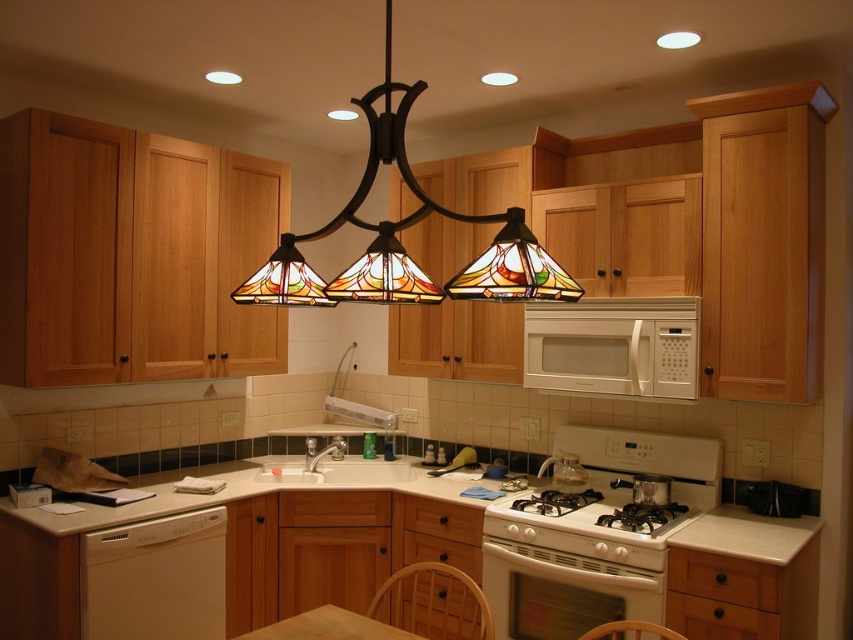
Can you confirm if white glossy oven at lower center is bigger than white glossy gas stove at center?

No.

From the picture: Between white glossy oven at lower center and white glossy gas stove at center, which one is positioned lower?

Positioned lower is white glossy oven at lower center.

Image resolution: width=853 pixels, height=640 pixels. Describe the element at coordinates (561, 592) in the screenshot. I see `white glossy oven at lower center` at that location.

The width and height of the screenshot is (853, 640). I want to click on white glossy oven at lower center, so click(561, 592).

Can you confirm if white laminate countertop at lower center is wider than white glossy oven at lower center?

Indeed, white laminate countertop at lower center has a greater width compared to white glossy oven at lower center.

Does white laminate countertop at lower center have a smaller size compared to white glossy oven at lower center?

No.

Is point (322, 592) positioned after point (596, 600)?

Yes, point (322, 592) is farther from viewer.

Identify the location of white laminate countertop at lower center. (395, 538).

Is white matte dishwasher at lower left below white glossy gas stove at center?

Correct, white matte dishwasher at lower left is located below white glossy gas stove at center.

Where is `white matte dishwasher at lower left`? This screenshot has height=640, width=853. white matte dishwasher at lower left is located at coordinates tap(155, 579).

Find the location of a particular element. The width and height of the screenshot is (853, 640). white matte dishwasher at lower left is located at coordinates (155, 579).